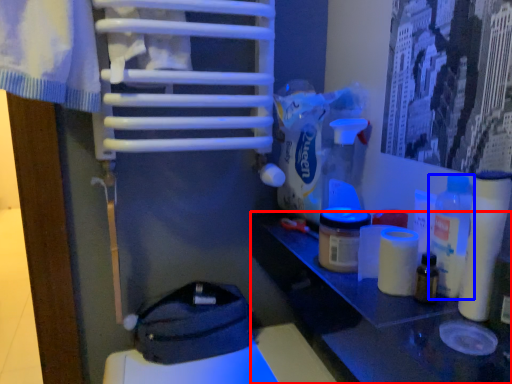
Question: Which object appears closest to the camera in this image, table (highlighted by a red box) or bottle (highlighted by a blue box)?

Choices:
 (A) table
 (B) bottle

Answer: (A)